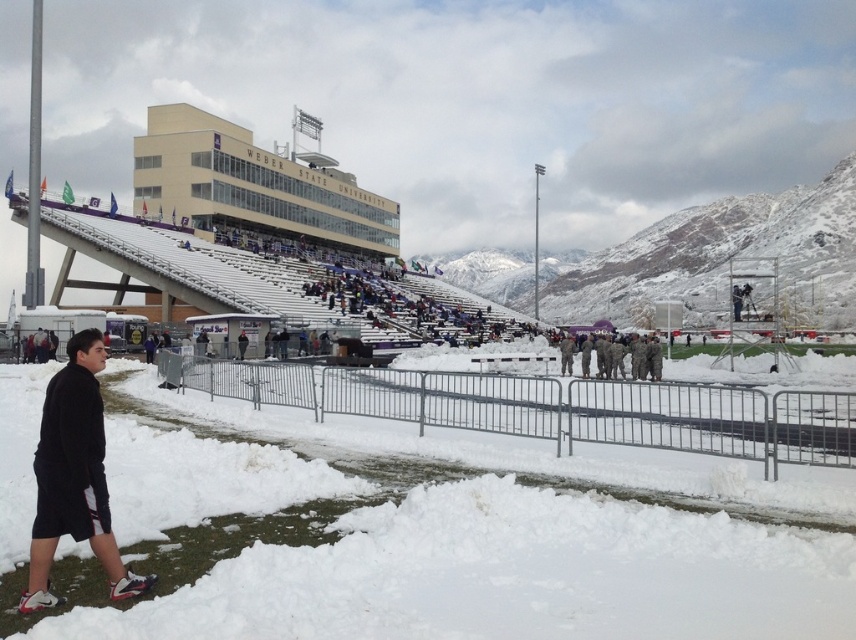
You are standing at the point marked by the coordinates (508, 576) in the snowy stadium scene. Which object is directly beneath you?

The point marked by the coordinates (508, 576) is directly above the white fluffy snow at lower left.

You are standing at the edge of the snowy area in the stadium. You want to walk to the WEBER STATE UNIVERSITY building located behind the seating area. The white fluffy snow at lower left is in your path. Given that you can walk 100 feet before needing to rest, do you need to rest before reaching the snow?

The distance between you and the white fluffy snow at lower left is 114.33 feet. Since you can walk 100 feet before resting, you would need to rest before reaching the snow because the distance exceeds your walking limit without rest.